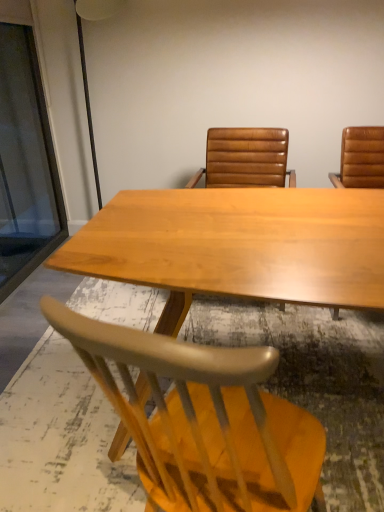
Where is `free spot above light brown wood table at center (from a real-world perspective)`? This screenshot has height=512, width=384. free spot above light brown wood table at center (from a real-world perspective) is located at coordinates pos(255,227).